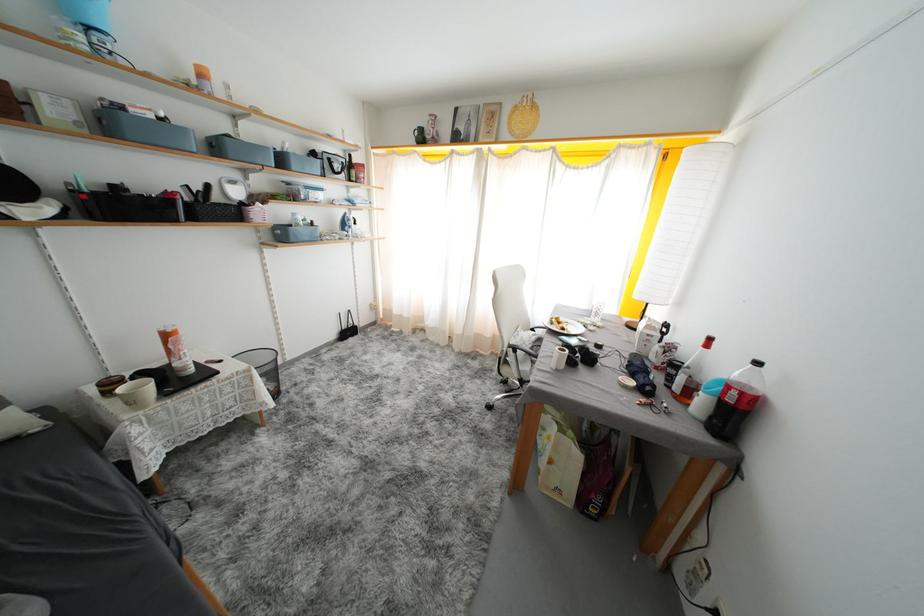
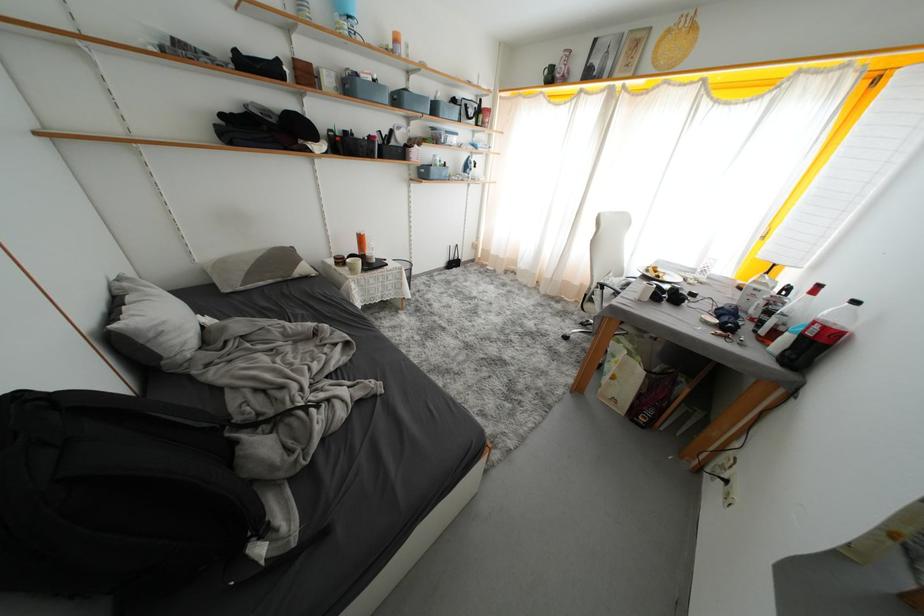
Where in the second image is the point corresponding to point (166, 123) from the first image?

(381, 84)